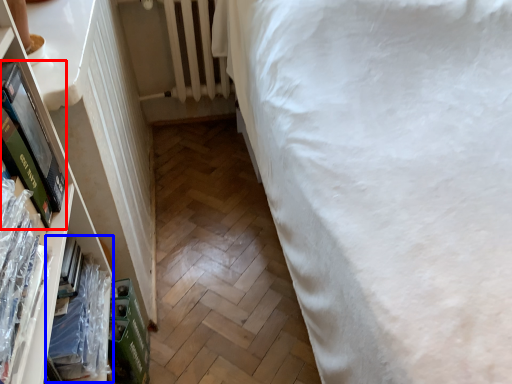
Question: Which of the following is the closest to the observer, paperback book (highlighted by a red box) or book (highlighted by a blue box)?

Choices:
 (A) paperback book
 (B) book

Answer: (A)